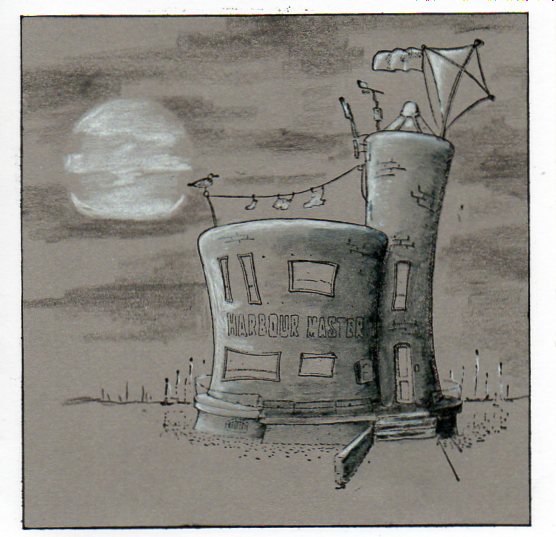
The height and width of the screenshot is (537, 556). In order to click on windows in this screenshot , I will do `click(335, 285)`.